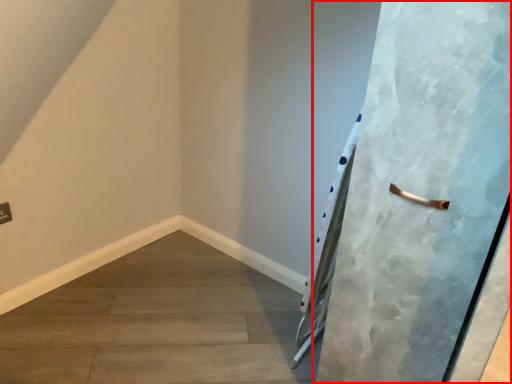
Question: From the image's perspective, where is door (annotated by the red box) located relative to concrete?

Choices:
 (A) above
 (B) below

Answer: (A)